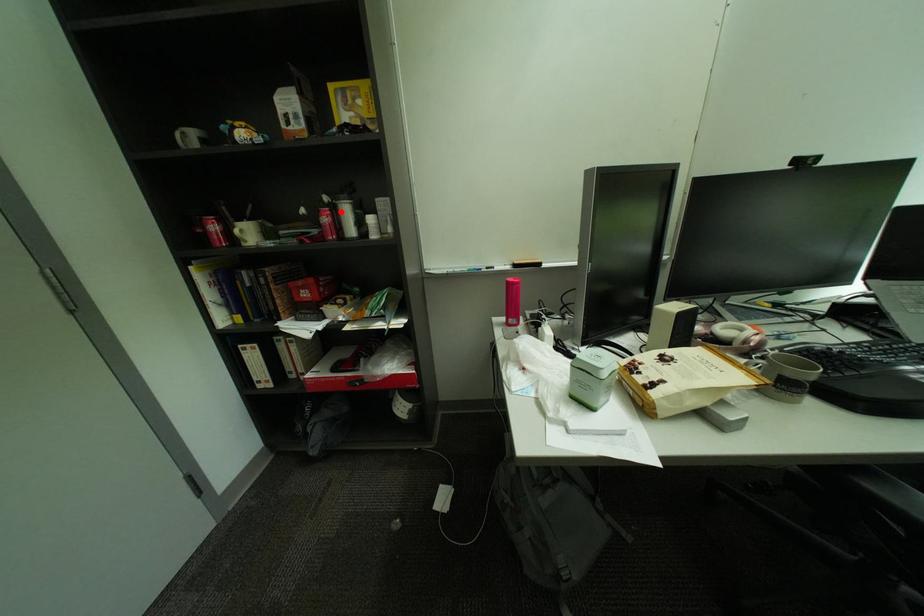
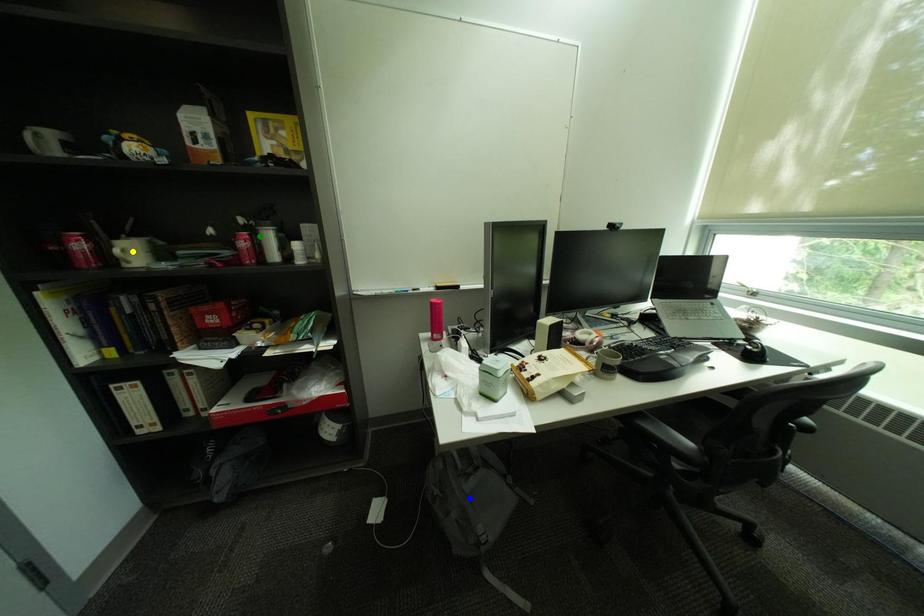
Question: I am providing you with two images of the same scene from different viewpoints. A red point is marked on the first image. You are given multiple points on the second image. Which spot in image 2 lines up with the point in image 1?

Choices:
 (A) yellow point
 (B) green point
 (C) blue point

Answer: (B)